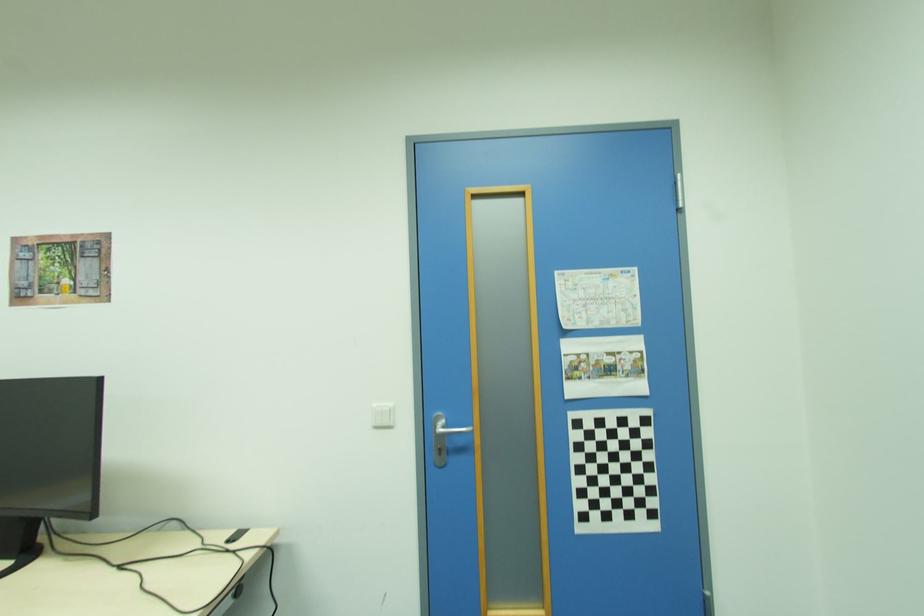
Locate an element on the screen. checkerboard paper is located at coordinates (613, 471).